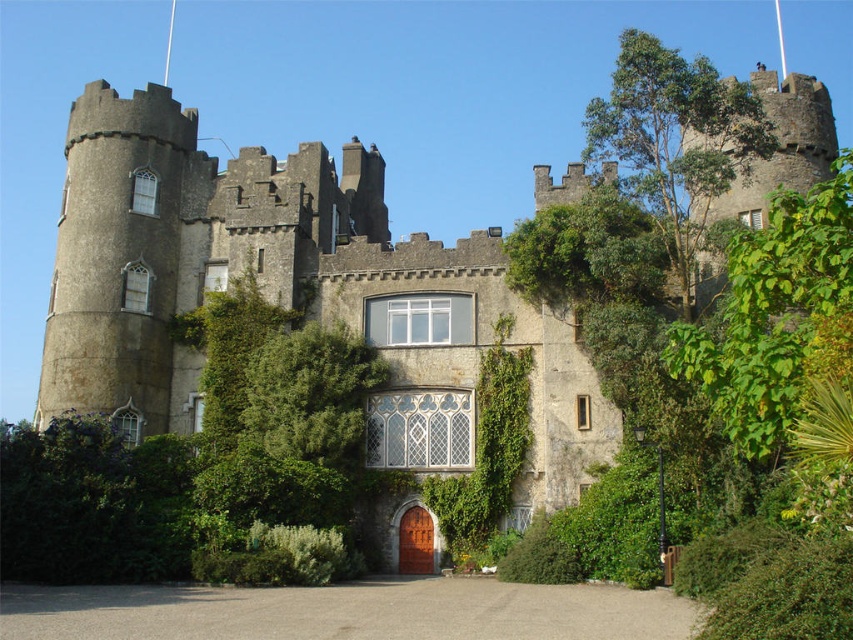
Question: Is gray stone castle at center to the left of mahogany wood door at center from the viewer's perspective?

Choices:
 (A) yes
 (B) no

Answer: (B)

Question: Observing the image, what is the correct spatial positioning of gray stone castle at center in reference to mahogany wood door at center?

Choices:
 (A) above
 (B) below

Answer: (A)

Question: Among these objects, which one is nearest to the camera?

Choices:
 (A) mahogany wood door at center
 (B) green leafy hedge at lower left
 (C) gray stone castle at center

Answer: (B)

Question: Is gray stone castle at center closer to camera compared to green leafy hedge at lower left?

Choices:
 (A) yes
 (B) no

Answer: (B)

Question: Which point is closer to the camera?

Choices:
 (A) (119, 326)
 (B) (403, 518)
 (C) (527, 600)
 (D) (115, 576)

Answer: (C)

Question: Which point appears farthest from the camera in this image?

Choices:
 (A) (38, 611)
 (B) (427, 524)
 (C) (96, 477)

Answer: (B)